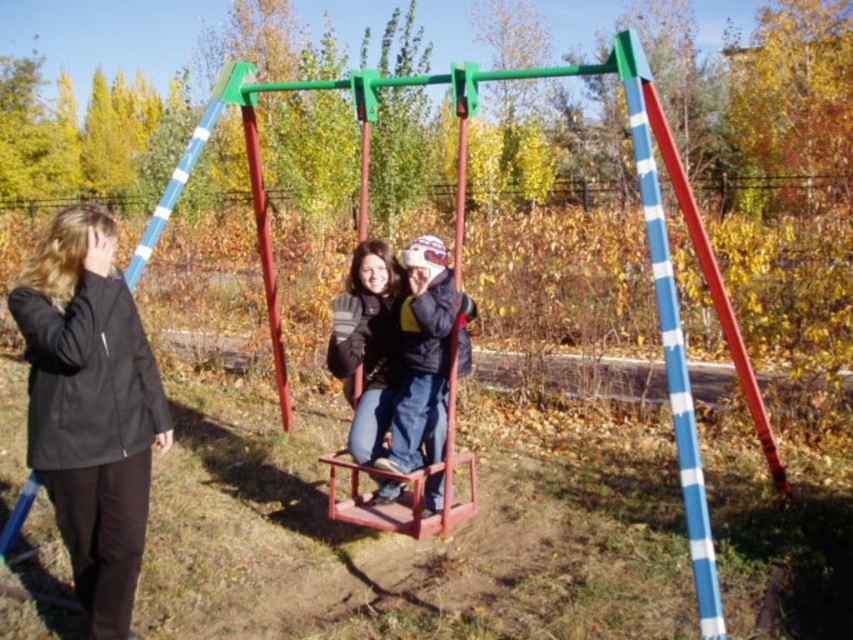
Question: Can you confirm if blue striped pole at right is wider than velvet blue jacket at center?

Choices:
 (A) no
 (B) yes

Answer: (A)

Question: Is black matte jacket at left to the right of metallic red swing at center from the viewer's perspective?

Choices:
 (A) yes
 (B) no

Answer: (B)

Question: Which point is farther to the camera?

Choices:
 (A) (120, 330)
 (B) (463, 305)
 (C) (682, 429)
 (D) (421, 273)

Answer: (B)

Question: Based on their relative distances, which object is nearer to the metallic red swing at center?

Choices:
 (A) black matte jacket at left
 (B) blue striped pole at right

Answer: (A)

Question: Is blue striped pole at right thinner than velvet blue jacket at center?

Choices:
 (A) no
 (B) yes

Answer: (B)

Question: Which of the following is the closest to the observer?

Choices:
 (A) velvet blue jacket at center
 (B) black matte jacket at left

Answer: (B)